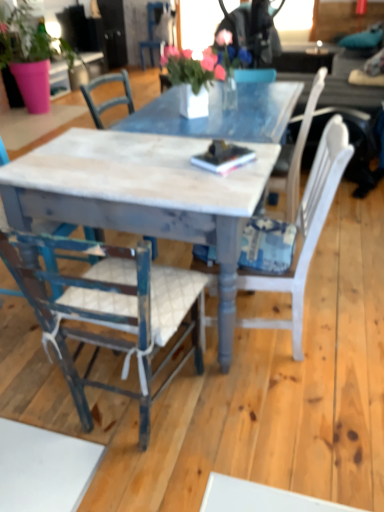
Identify the location of free spot above white marble table at center (from a real-world perspective). (159, 151).